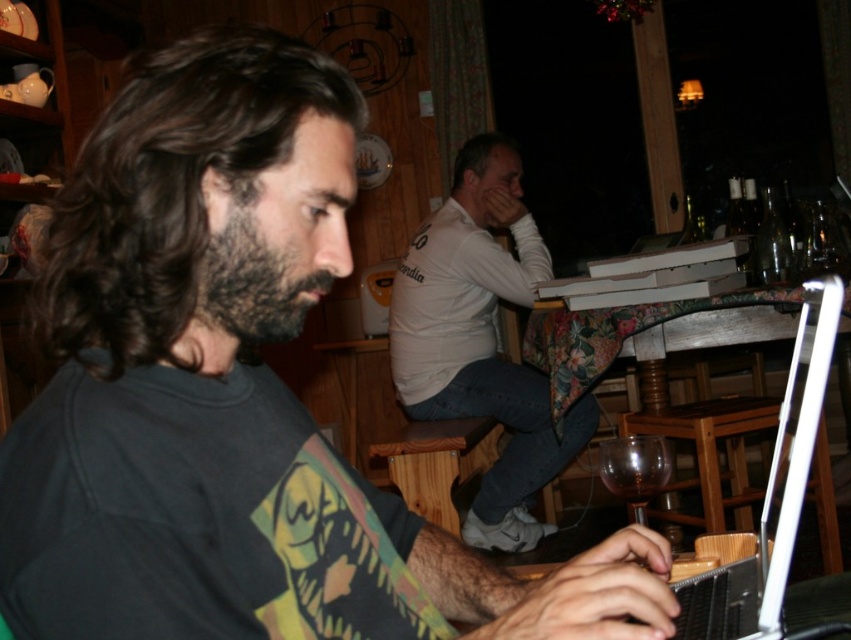
Question: From the image, what is the correct spatial relationship of dark brown fuzzy beard at left in relation to dark brown hair at upper center?

Choices:
 (A) below
 (B) above

Answer: (A)

Question: Which object is the closest to the white plastic laptop at lower right?

Choices:
 (A) dark brown fuzzy beard at left
 (B) wooden stool at lower center
 (C) transparent glass wine glass at lower center
 (D) dark brown hair at upper center

Answer: (C)

Question: Can you confirm if white plastic laptop at lower right is bigger than dark brown hair at upper center?

Choices:
 (A) yes
 (B) no

Answer: (A)

Question: Estimate the real-world distances between objects in this image. Which object is farther from the dark brown fuzzy beard at left?

Choices:
 (A) dark brown wavy hair at left
 (B) white plastic laptop at lower right
 (C) white cotton shirt at upper center
 (D) dark brown hair at upper center

Answer: (D)

Question: Can you confirm if dark brown fuzzy beard at left is smaller than dark brown hair at upper center?

Choices:
 (A) yes
 (B) no

Answer: (A)

Question: Which point is closer to the camera?

Choices:
 (A) white plastic laptop at lower right
 (B) dark brown wavy hair at left

Answer: (B)